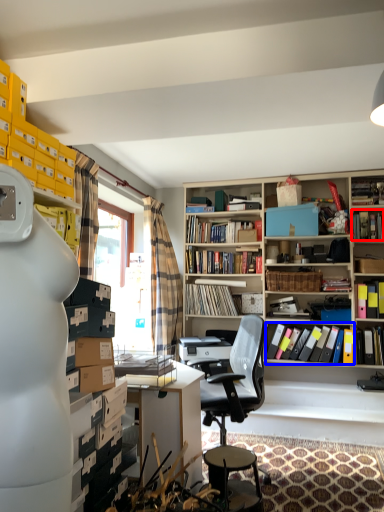
Question: Which object appears farthest to the camera in this image, book (highlighted by a red box) or book (highlighted by a blue box)?

Choices:
 (A) book
 (B) book

Answer: (A)